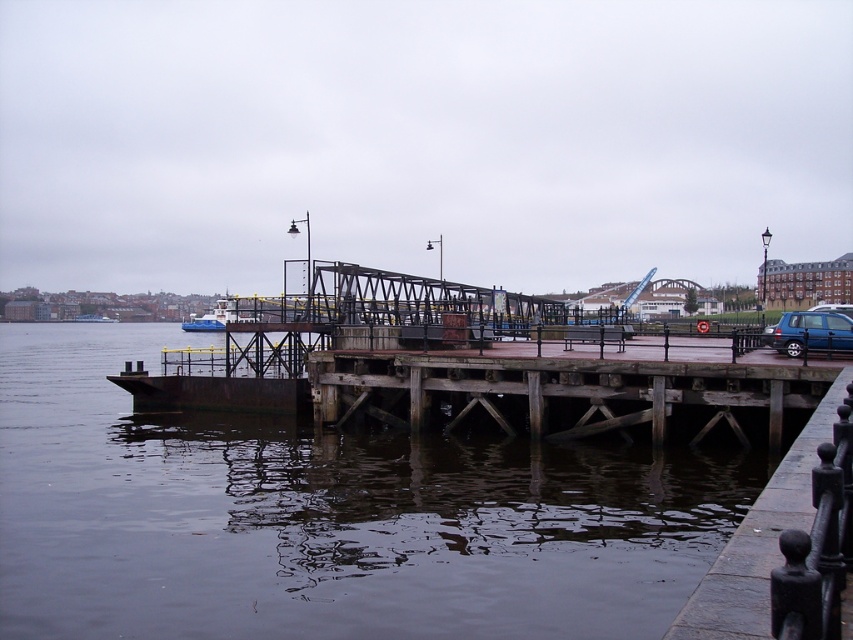
You are standing on the wooden pier and want to take a photo of the dark gray water at lower left and the blue metallic van at right. Which object appears taller in the frame?

The dark gray water at lower left appears taller than the blue metallic van at right in the frame.

Based on the photo, you are standing at the waterfront and looking at the wooden pier. There are two points marked on the pier at coordinates point (816, 346) and point (233, 308). Which point is nearer to you?

Point (816, 346) is closer to the camera than point (233, 308), so the point nearer to you is point (816, 346).

You are standing on the pier and want to cross to the other side. The dark gray water at lower left and the rusty metal bridge at center are in your path. Which one should you avoid stepping on to reach the other side safely?

You should avoid stepping on the dark gray water at lower left because it is located above the rusty metal bridge at center, meaning the bridge is the solid structure below and the water is above, so stepping on the water would not be safe.